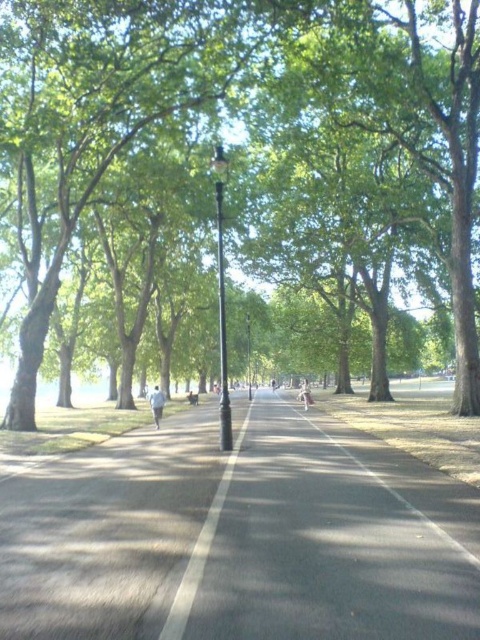
Where is `black asphalt road at center`? black asphalt road at center is located at coordinates (403, 476).

Find the location of a particular element. The height and width of the screenshot is (640, 480). black asphalt road at center is located at coordinates (403, 476).

Measure the distance between black asphalt road at center and camera.

A distance of 6.56 meters exists between black asphalt road at center and camera.

Is black asphalt road at center to the right of black metal lamp post at center from the viewer's perspective?

Yes, black asphalt road at center is to the right of black metal lamp post at center.

At what (x,y) coordinates should I click in order to perform the action: click on black asphalt road at center. Please return your answer as a coordinate pair (x, y). The width and height of the screenshot is (480, 640). Looking at the image, I should click on (403, 476).

Where is `black asphalt road at center`? Image resolution: width=480 pixels, height=640 pixels. black asphalt road at center is located at coordinates (403, 476).

Can you confirm if green leafy tree at center is taller than black metal lamp post at center?

Indeed, green leafy tree at center has a greater height compared to black metal lamp post at center.

Is point (175, 140) behind point (250, 320)?

No, it is not.

At what (x,y) coordinates should I click in order to perform the action: click on green leafy tree at center. Please return your answer as a coordinate pair (x, y). The image size is (480, 640). Looking at the image, I should click on (248, 138).